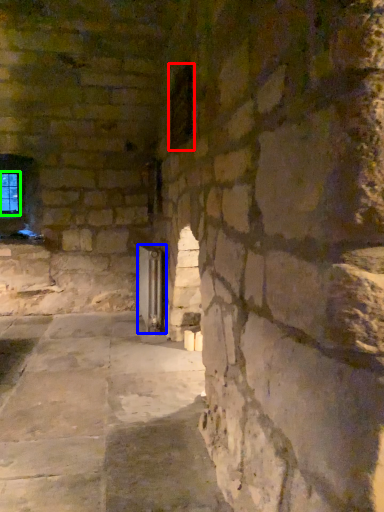
Question: Which object is the farthest from window (highlighted by a red box)? Choose among these: glass door (highlighted by a blue box) or window (highlighted by a green box).

Choices:
 (A) glass door
 (B) window

Answer: (B)